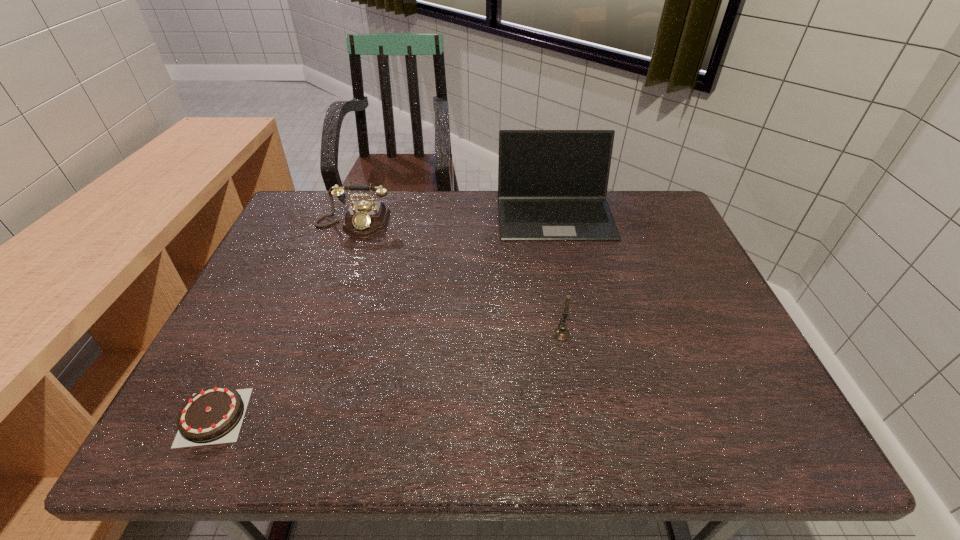
At what (x,y) coordinates should I click in order to perform the action: click on laptop. Please return your answer as a coordinate pair (x, y). Looking at the image, I should click on (552, 184).

In order to click on telephone in this screenshot , I will do click(x=364, y=219).

The image size is (960, 540). I want to click on candle, so click(562, 334).

Where is `the shortest object`? This screenshot has height=540, width=960. the shortest object is located at coordinates (214, 415).

In order to click on the nearest object in this screenshot , I will do [214, 415].

Locate an element on the screen. free point located on the screen of the tallest object is located at coordinates (564, 257).

Where is `free space located on the dial of the telephone`? The image size is (960, 540). free space located on the dial of the telephone is located at coordinates (319, 323).

Where is `vacant region located 0.170m on the right of the third farthest object`? vacant region located 0.170m on the right of the third farthest object is located at coordinates (644, 335).

What are the coordinates of `vacant space located on the back of the shortest object` in the screenshot? It's located at (250, 342).

Identify the location of laptop that is at the far edge. The width and height of the screenshot is (960, 540). (552, 184).